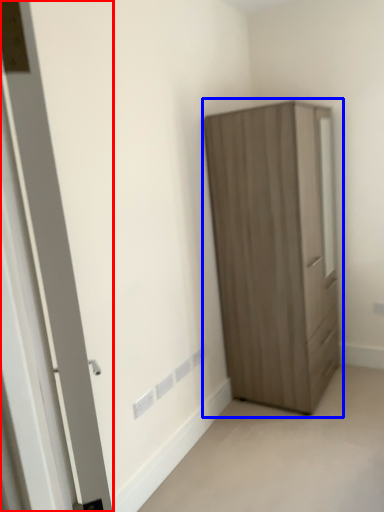
Question: Which object is closer to the camera taking this photo, door (highlighted by a red box) or cupboard (highlighted by a blue box)?

Choices:
 (A) door
 (B) cupboard

Answer: (A)